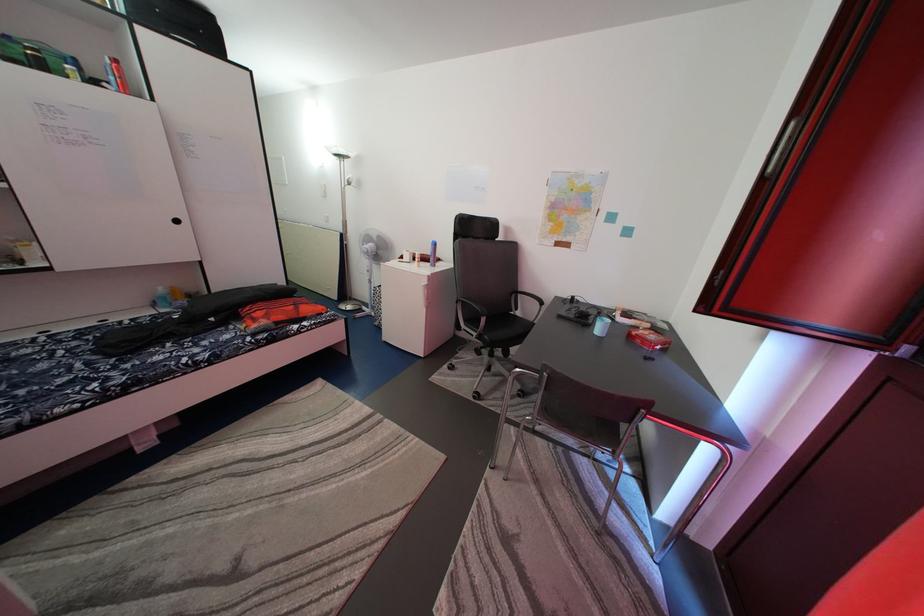
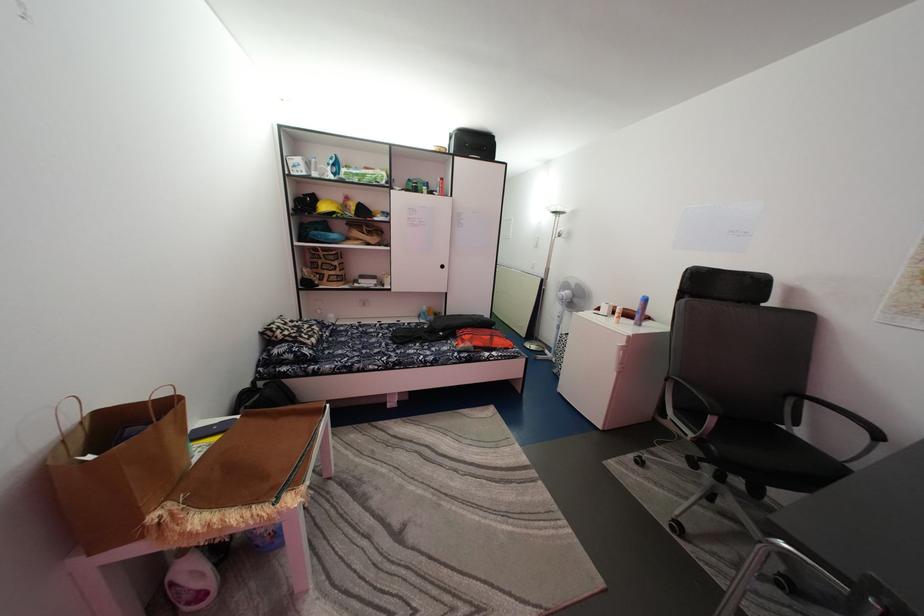
In the second image, find the point that corresponds to pixel 433 265 in the first image.

(637, 322)